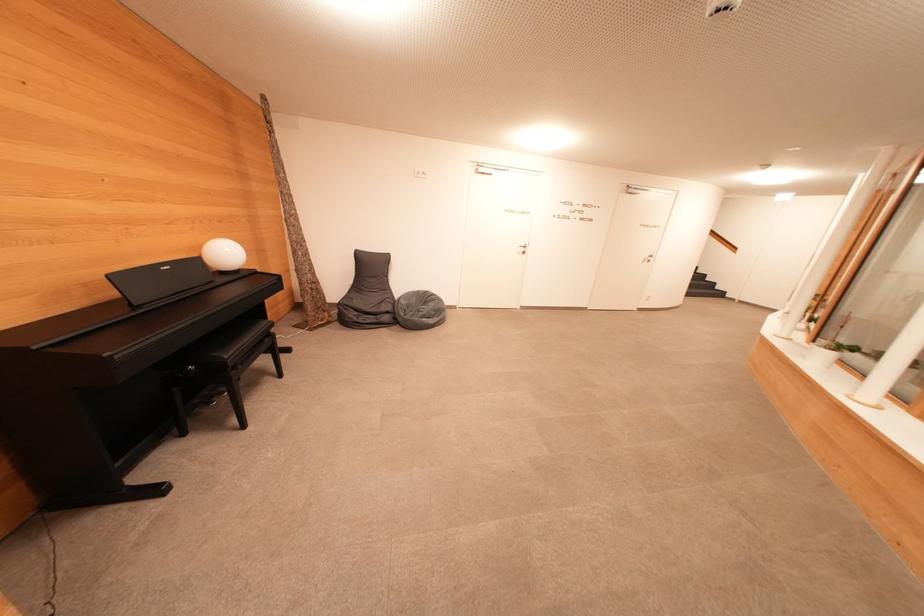
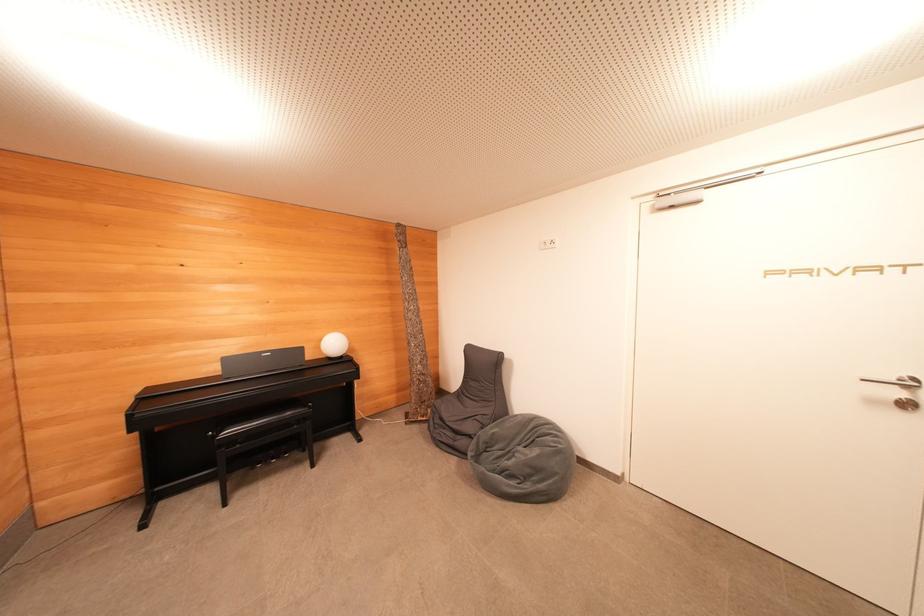
The point at (x=232, y=257) is marked in the first image. Where is the corresponding point in the second image?

(337, 347)